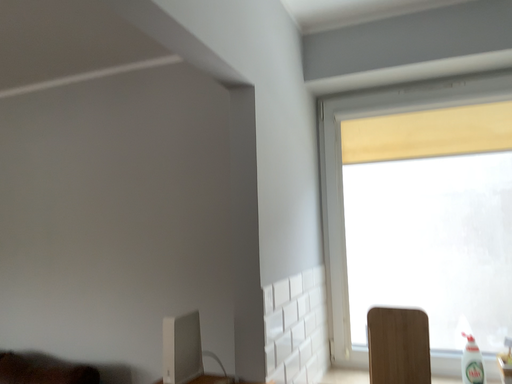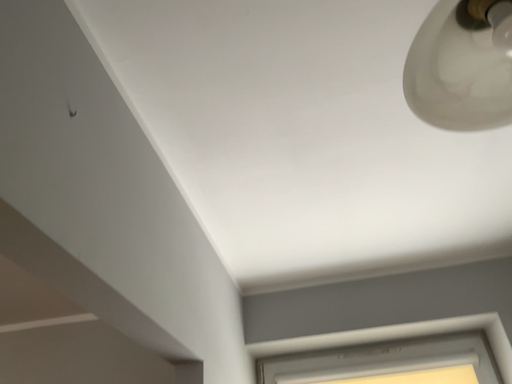
Question: How did the camera likely rotate when shooting the video?

Choices:
 (A) rotated upward
 (B) rotated downward

Answer: (A)